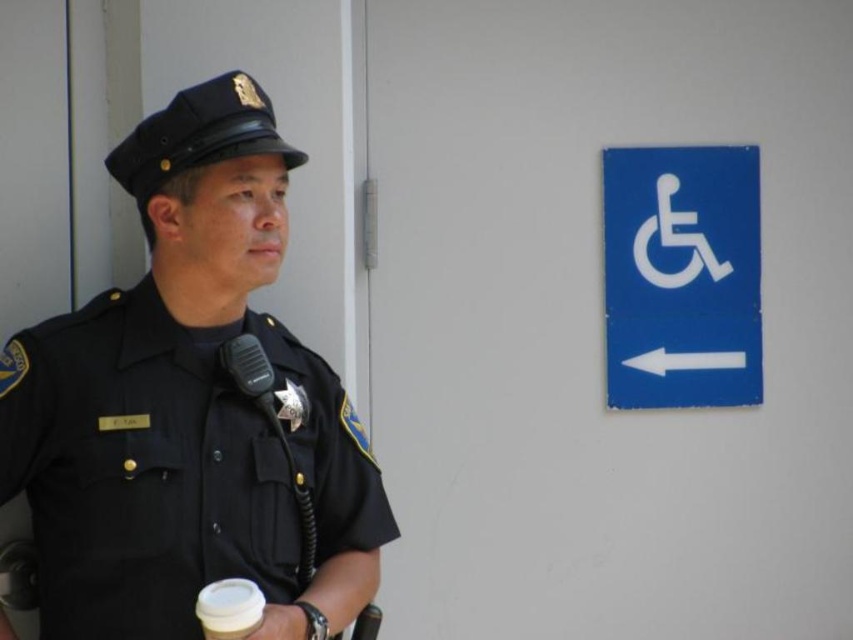
You are an officer who just entered the room and need to reach the white paper cup at lower center. The blue metal sign at upper right is blocking your path. Can you move around the sign to get to the cup?

The white paper cup at lower center is behind the blue metal sign at upper right, so you can move around the sign to access the cup as long as there is space to navigate around it.

You are a person with a disability entering the room and need to locate the wheelchair access area. You see the black uniform at left and the blue sign with white wheelchair symbol to the right. Which direction should you move towards to reach the wheelchair access area?

The blue sign with white wheelchair symbol to the right indicates the direction to the left for the wheelchair access area. Therefore, you should move towards the left direction indicated by the sign.